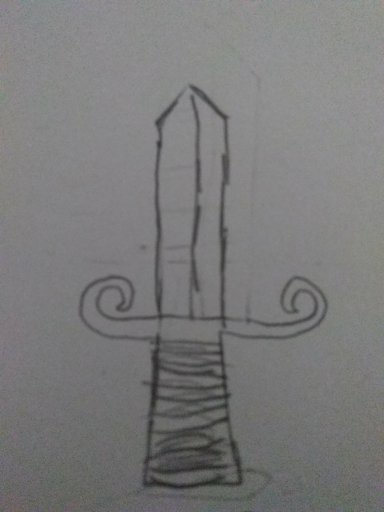
Where is `handle`? This screenshot has width=384, height=512. handle is located at coordinates (205, 446).